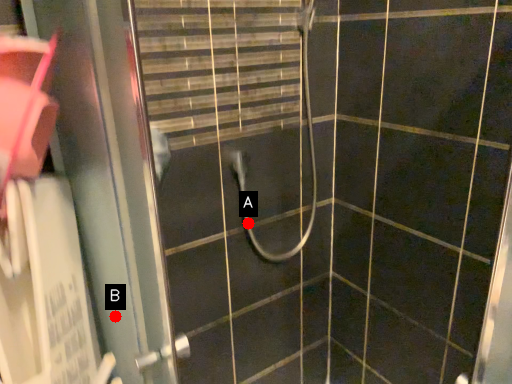
Question: Two points are circled on the image, labeled by A and B beside each circle. Which point is farther to the camera?

Choices:
 (A) A is further
 (B) B is further

Answer: (A)